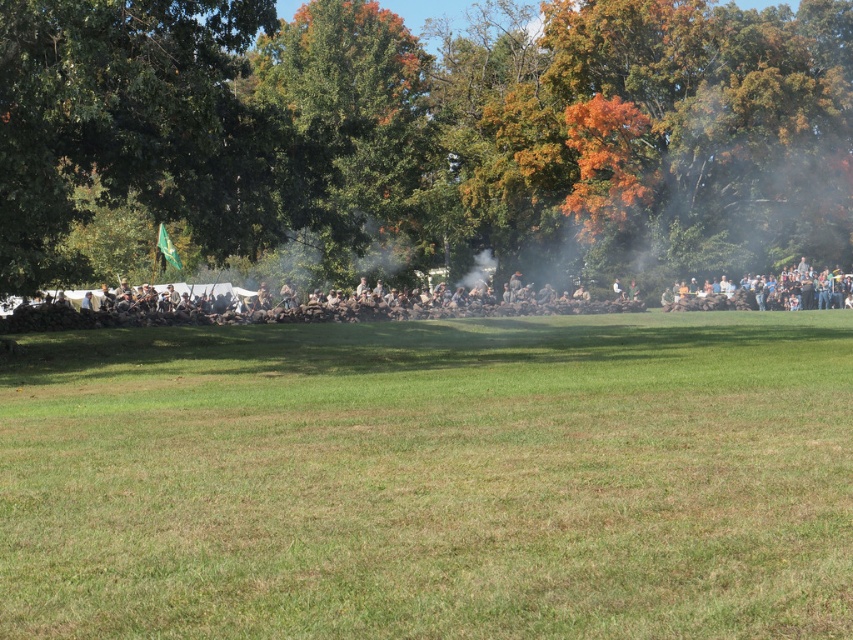
Question: Which point is farther to the camera?

Choices:
 (A) brown fabric uniform at center
 (B) green leafy tree at upper center
 (C) green leafy tree at center

Answer: (C)

Question: Is green grassy field at center positioned at the back of green leafy tree at upper center?

Choices:
 (A) no
 (B) yes

Answer: (A)

Question: Is green leafy tree at center positioned at the back of brown fabric uniform at center?

Choices:
 (A) no
 (B) yes

Answer: (B)

Question: Which of the following is the closest to the observer?

Choices:
 (A) brown fabric uniform at center
 (B) green leafy tree at upper center
 (C) green leafy tree at center
 (D) green grassy field at center

Answer: (D)

Question: Considering the real-world distances, which object is closest to the green leafy tree at upper center?

Choices:
 (A) brown fabric uniform at center
 (B) green leafy tree at center
 (C) green grassy field at center

Answer: (B)

Question: Does green leafy tree at upper center have a greater width compared to brown fabric uniform at center?

Choices:
 (A) yes
 (B) no

Answer: (A)